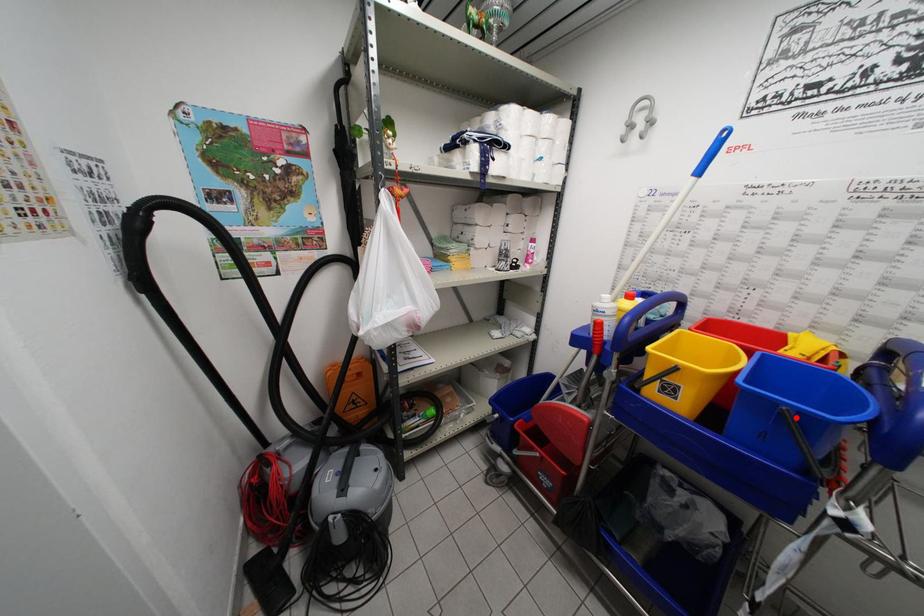
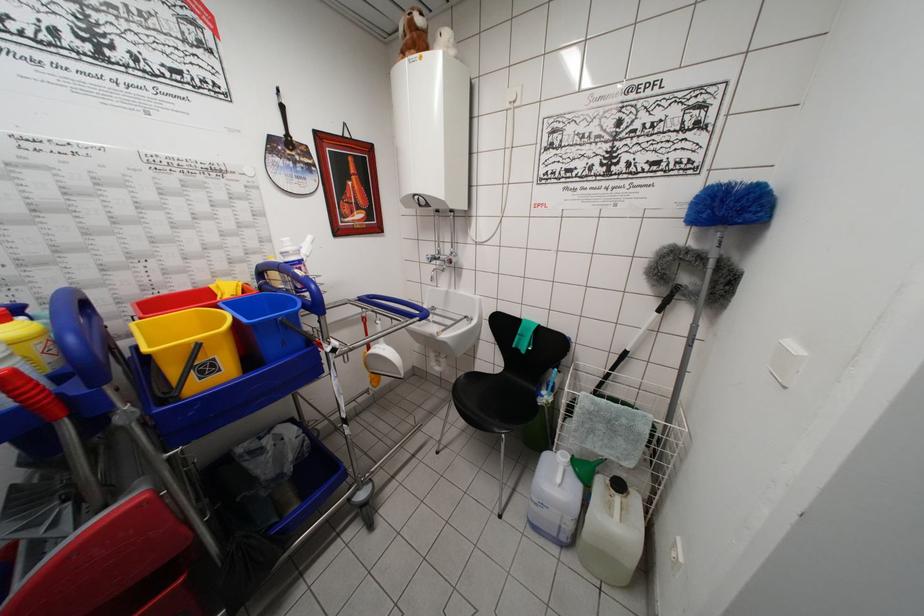
Find the pixel in the second image that matches the highlighted location in the first image.

(287, 323)